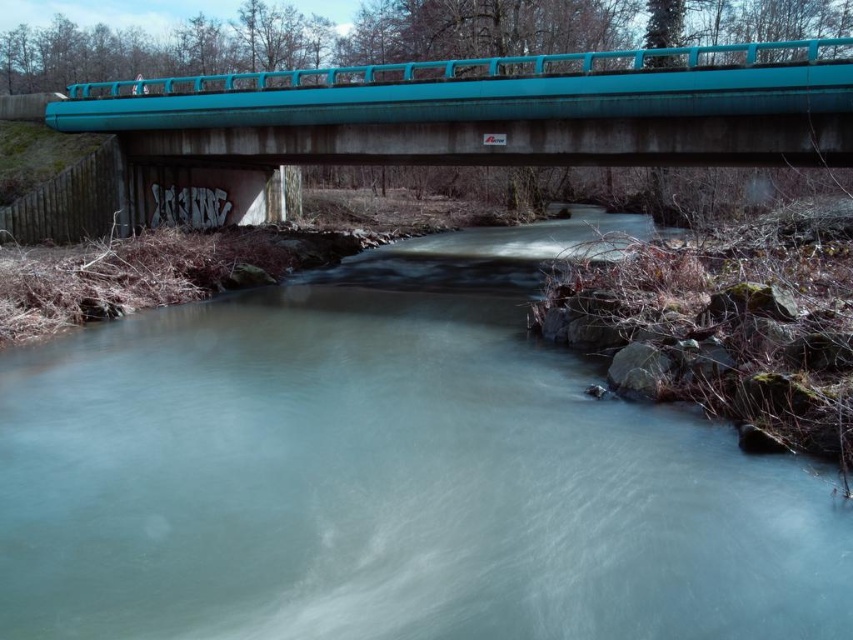
Is clear water at center to the left of teal concrete bridge at upper center from the viewer's perspective?

Correct, you'll find clear water at center to the left of teal concrete bridge at upper center.

How far apart are clear water at center and teal concrete bridge at upper center?

clear water at center is 6.94 meters from teal concrete bridge at upper center.

What do you see at coordinates (392, 474) in the screenshot?
I see `clear water at center` at bounding box center [392, 474].

Identify the location of clear water at center. (392, 474).